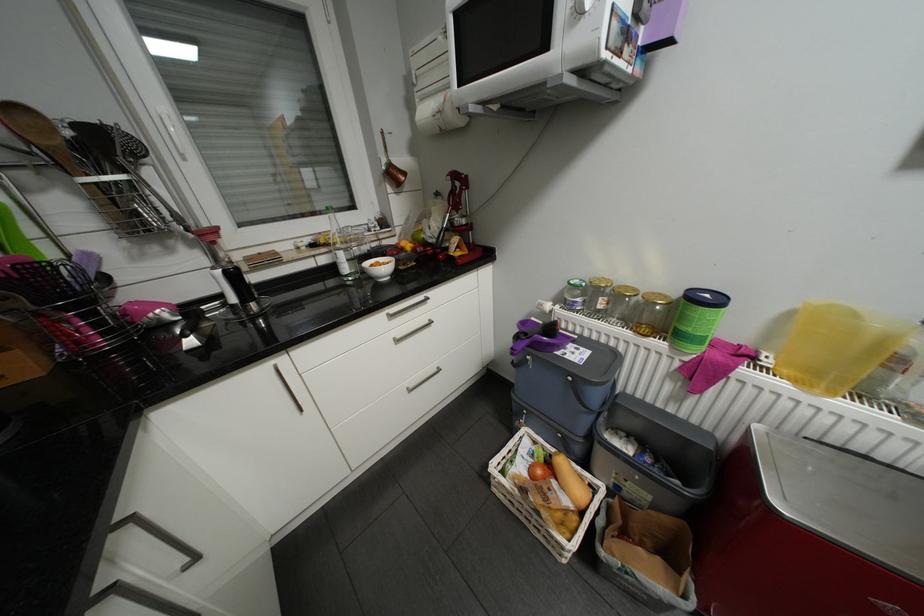
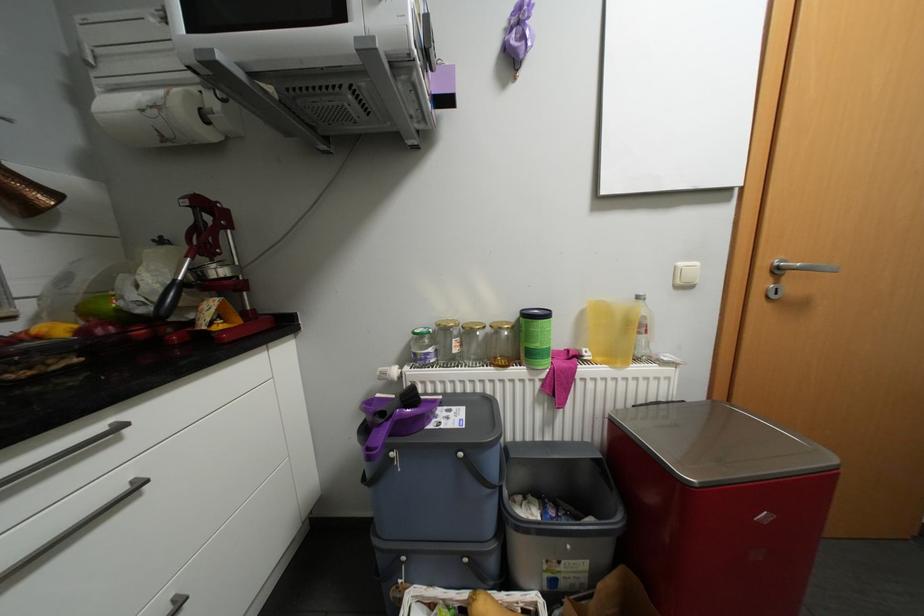
Question: The first image is from the beginning of the video and the second image is from the end. How did the camera likely rotate when shooting the video?

Choices:
 (A) Left
 (B) Right
 (C) Up
 (D) Down

Answer: (B)